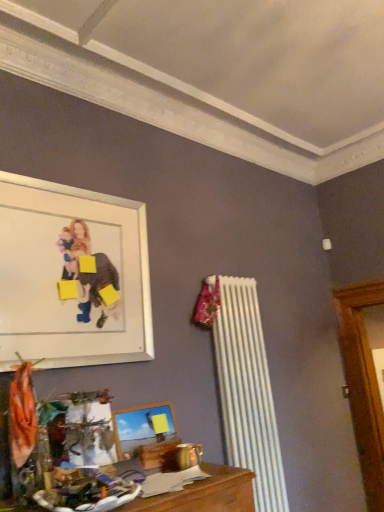
Question: Does white matte picture frame at upper left, the second picture frame when ordered from bottom to top, have a lesser height compared to wooden picture frame at lower center, which ranks as the 2th picture frame in top-to-bottom order?

Choices:
 (A) yes
 (B) no

Answer: (B)

Question: Is white matte picture frame at upper left, the second picture frame when ordered from bottom to top, far away from wooden picture frame at lower center, which ranks as the 2th picture frame in top-to-bottom order?

Choices:
 (A) yes
 (B) no

Answer: (B)

Question: From the image's perspective, does white matte picture frame at upper left, marked as the first picture frame in a top-to-bottom arrangement, appear higher than wooden picture frame at lower center, which is the 1th picture frame from bottom to top?

Choices:
 (A) yes
 (B) no

Answer: (A)

Question: Does white matte picture frame at upper left, marked as the first picture frame in a top-to-bottom arrangement, come behind wooden picture frame at lower center, which is the 1th picture frame from bottom to top?

Choices:
 (A) yes
 (B) no

Answer: (B)

Question: Is white matte picture frame at upper left, the second picture frame when ordered from bottom to top, oriented away from wooden picture frame at lower center, which ranks as the 2th picture frame in top-to-bottom order?

Choices:
 (A) no
 (B) yes

Answer: (A)

Question: Considering the relative sizes of white matte picture frame at upper left, marked as the first picture frame in a top-to-bottom arrangement, and wooden picture frame at lower center, which ranks as the 2th picture frame in top-to-bottom order, in the image provided, is white matte picture frame at upper left, marked as the first picture frame in a top-to-bottom arrangement, smaller than wooden picture frame at lower center, which ranks as the 2th picture frame in top-to-bottom order,?

Choices:
 (A) yes
 (B) no

Answer: (B)

Question: Is wooden picture frame at lower center, which is the 1th picture frame from bottom to top, directly adjacent to white matte picture frame at upper left, marked as the first picture frame in a top-to-bottom arrangement?

Choices:
 (A) yes
 (B) no

Answer: (B)

Question: Is wooden picture frame at lower center, which ranks as the 2th picture frame in top-to-bottom order, outside of white matte picture frame at upper left, marked as the first picture frame in a top-to-bottom arrangement?

Choices:
 (A) no
 (B) yes

Answer: (B)

Question: Does wooden picture frame at lower center, which is the 1th picture frame from bottom to top, have a larger size compared to white matte picture frame at upper left, the second picture frame when ordered from bottom to top?

Choices:
 (A) yes
 (B) no

Answer: (B)

Question: Is wooden picture frame at lower center, which is the 1th picture frame from bottom to top, positioned with its back to white matte picture frame at upper left, the second picture frame when ordered from bottom to top?

Choices:
 (A) yes
 (B) no

Answer: (B)

Question: From a real-world perspective, does wooden picture frame at lower center, which is the 1th picture frame from bottom to top, stand above white matte picture frame at upper left, marked as the first picture frame in a top-to-bottom arrangement?

Choices:
 (A) yes
 (B) no

Answer: (B)

Question: Could you tell me if wooden picture frame at lower center, which is the 1th picture frame from bottom to top, is turned towards white matte picture frame at upper left, marked as the first picture frame in a top-to-bottom arrangement?

Choices:
 (A) no
 (B) yes

Answer: (A)

Question: Considering the positions of white matte picture frame at upper left, the second picture frame when ordered from bottom to top, and wooden picture frame at lower center, which ranks as the 2th picture frame in top-to-bottom order, in the image, is white matte picture frame at upper left, the second picture frame when ordered from bottom to top, taller or shorter than wooden picture frame at lower center, which ranks as the 2th picture frame in top-to-bottom order,?

Choices:
 (A) short
 (B) tall

Answer: (B)